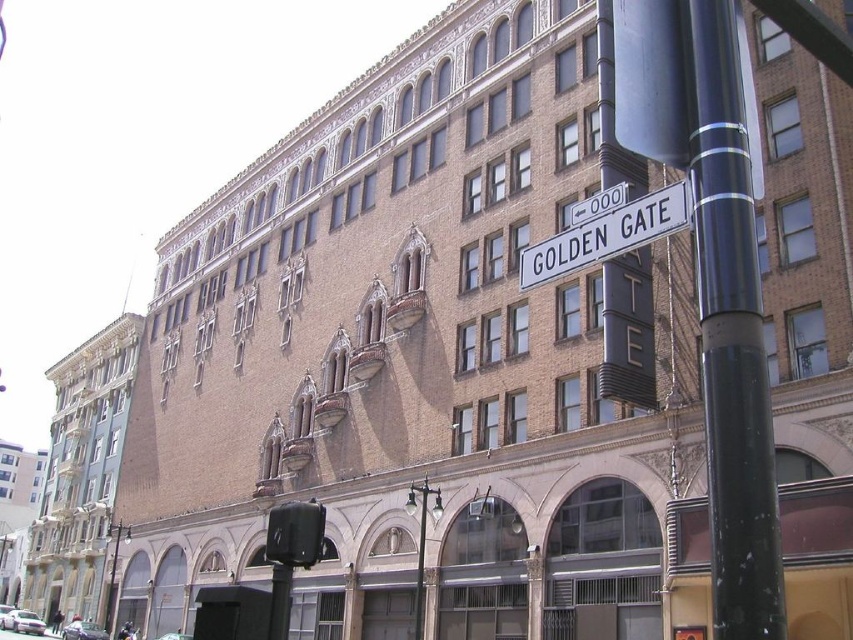
In the scene shown: Between white plastic street sign at upper center and metallic silver car at lower left, which one appears on the left side from the viewer's perspective?

From the viewer's perspective, metallic silver car at lower left appears more on the left side.

Can you confirm if white plastic street sign at upper center is positioned below metallic silver car at lower left?

No.

Is point (595, 252) closer to viewer compared to point (169, 636)?

Yes, it is.

At what (x,y) coordinates should I click in order to perform the action: click on white plastic street sign at upper center. Please return your answer as a coordinate pair (x, y). The height and width of the screenshot is (640, 853). Looking at the image, I should click on (606, 236).

Can you confirm if silver metallic car at lower left is bigger than metallic silver car at lower left?

Yes, silver metallic car at lower left is bigger than metallic silver car at lower left.

Who is higher up, silver metallic car at lower left or metallic silver car at lower left?

Result: metallic silver car at lower left

What are the coordinates of `silver metallic car at lower left` in the screenshot? It's located at (83, 630).

Can you confirm if black polished pole at right is positioned to the left of white plastic street sign at upper center?

Incorrect, black polished pole at right is not on the left side of white plastic street sign at upper center.

Which is behind, point (718, 369) or point (650, 200)?

Positioned behind is point (650, 200).

Does point (722, 272) come farther from viewer compared to point (587, 224)?

No, it is not.

The image size is (853, 640). I want to click on black polished pole at right, so click(730, 339).